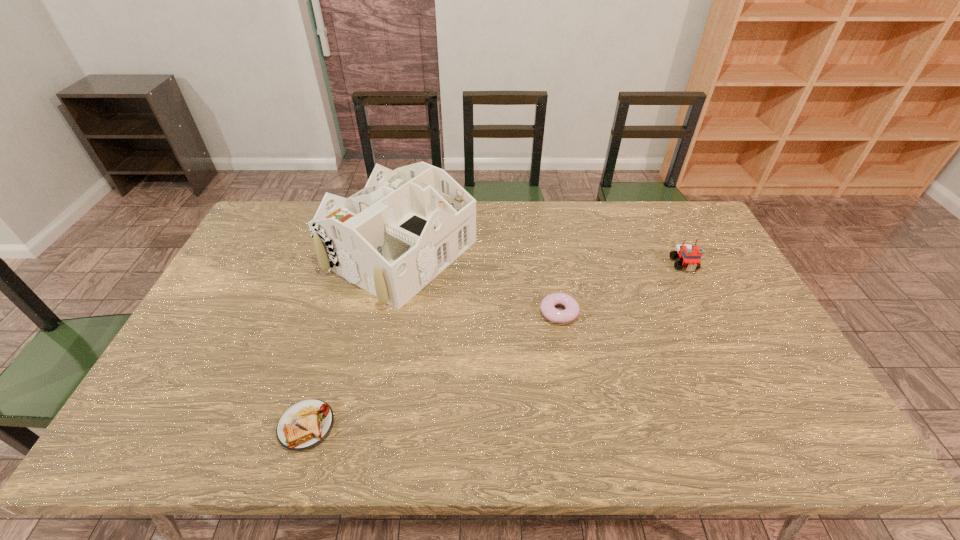
Image resolution: width=960 pixels, height=540 pixels. Find the location of `free space located 0.310m on the back of the nearest object`. free space located 0.310m on the back of the nearest object is located at coordinates (343, 306).

At what (x,y) coordinates should I click in order to perform the action: click on object present at the far edge. Please return your answer as a coordinate pair (x, y). Looking at the image, I should click on (392, 238).

I want to click on object that is at the near edge, so click(x=304, y=425).

The height and width of the screenshot is (540, 960). Find the location of `object that is at the right edge`. object that is at the right edge is located at coordinates [689, 255].

In the image, there is a desktop. Where is `vacant area at the far edge`? Image resolution: width=960 pixels, height=540 pixels. vacant area at the far edge is located at coordinates (312, 209).

In the image, there is a desktop. Where is `free region at the near edge`? Image resolution: width=960 pixels, height=540 pixels. free region at the near edge is located at coordinates point(326,443).

I want to click on free space at the near left corner of the desktop, so click(123, 443).

What are the coordinates of `vacant region at the far right corner of the desktop` in the screenshot? It's located at (684, 224).

Image resolution: width=960 pixels, height=540 pixels. In the image, there is a desktop. What are the coordinates of `vacant space at the near right corner` in the screenshot? It's located at (824, 428).

Find the location of `vacant area that lies between the Lego and the dollhouse`. vacant area that lies between the Lego and the dollhouse is located at coordinates (542, 259).